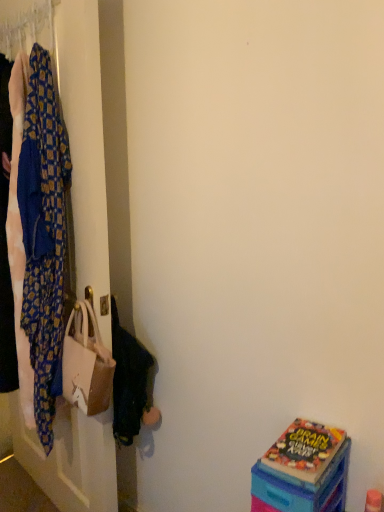
Question: Can you confirm if beige fabric handbag at left is wider than matte plastic box at lower right?

Choices:
 (A) no
 (B) yes

Answer: (A)

Question: Does beige fabric handbag at left come in front of matte plastic box at lower right?

Choices:
 (A) no
 (B) yes

Answer: (A)

Question: Considering the relative sizes of beige fabric handbag at left and matte plastic box at lower right in the image provided, is beige fabric handbag at left shorter than matte plastic box at lower right?

Choices:
 (A) yes
 (B) no

Answer: (B)

Question: Would you say matte plastic box at lower right is part of beige fabric handbag at left's contents?

Choices:
 (A) yes
 (B) no

Answer: (B)

Question: Is beige fabric handbag at left placed right next to matte plastic box at lower right?

Choices:
 (A) yes
 (B) no

Answer: (B)

Question: From a real-world perspective, is matte plastic box at lower right above or below beige fabric handbag at left?

Choices:
 (A) above
 (B) below

Answer: (B)

Question: Looking at their shapes, would you say matte plastic box at lower right is wider or thinner than beige fabric handbag at left?

Choices:
 (A) thin
 (B) wide

Answer: (B)

Question: Visually, is matte plastic box at lower right positioned to the left or to the right of beige fabric handbag at left?

Choices:
 (A) right
 (B) left

Answer: (A)

Question: From the image's perspective, relative to beige fabric handbag at left, is matte plastic box at lower right above or below?

Choices:
 (A) above
 (B) below

Answer: (B)

Question: Looking at their shapes, would you say beige fabric handbag at left is wider or thinner than blue patterned fabric at left?

Choices:
 (A) thin
 (B) wide

Answer: (A)

Question: Considering the positions of point (104, 349) and point (51, 343), is point (104, 349) closer or farther from the camera than point (51, 343)?

Choices:
 (A) closer
 (B) farther

Answer: (A)

Question: From a real-world perspective, is beige fabric handbag at left above or below blue patterned fabric at left?

Choices:
 (A) below
 (B) above

Answer: (A)

Question: In terms of height, does beige fabric handbag at left look taller or shorter compared to blue patterned fabric at left?

Choices:
 (A) tall
 (B) short

Answer: (B)

Question: Is blue patterned fabric at left wider or thinner than matte plastic box at lower right?

Choices:
 (A) thin
 (B) wide

Answer: (A)

Question: Based on their positions, is blue patterned fabric at left located to the left or right of matte plastic box at lower right?

Choices:
 (A) right
 (B) left

Answer: (B)